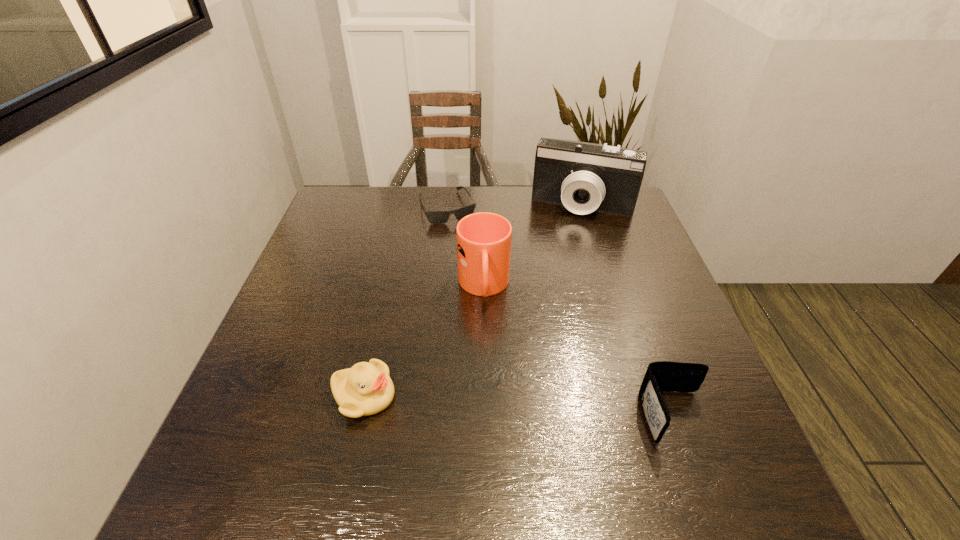
You are a GUI agent. You are given a task and a screenshot of the screen. Output one action in this format:
    pyautogui.click(x=<x>, y=<y>)
    Task: Click on the object identified as the second closest to the wallet
    
    Given the screenshot: What is the action you would take?
    pyautogui.click(x=365, y=389)

I want to click on the second closest object to the duckling, so click(x=660, y=376).

Locate an element on the screen. This screenshot has height=540, width=960. free space in the image that satisfies the following two spatial constraints: 1. on the back side of the third nearest object; 2. on the right side of the camcorder is located at coordinates (483, 206).

You are a GUI agent. You are given a task and a screenshot of the screen. Output one action in this format:
    pyautogui.click(x=<x>, y=<y>)
    Task: Click on the free region that satisfies the following two spatial constraints: 1. on the back side of the tallest object; 2. on the right side of the fourth shortest object
    The image size is (960, 540).
    Given the screenshot: What is the action you would take?
    pyautogui.click(x=483, y=206)

This screenshot has height=540, width=960. Find the location of `vacant position in the image that satisfies the following two spatial constraints: 1. on the back side of the camcorder; 2. on the right side of the shortest object`. vacant position in the image that satisfies the following two spatial constraints: 1. on the back side of the camcorder; 2. on the right side of the shortest object is located at coordinates (447, 206).

You are a GUI agent. You are given a task and a screenshot of the screen. Output one action in this format:
    pyautogui.click(x=<x>, y=<y>)
    Task: Click on the free location that satisfies the following two spatial constraints: 1. on the back side of the camcorder; 2. on the right side of the shortest object
    
    Given the screenshot: What is the action you would take?
    pyautogui.click(x=447, y=206)